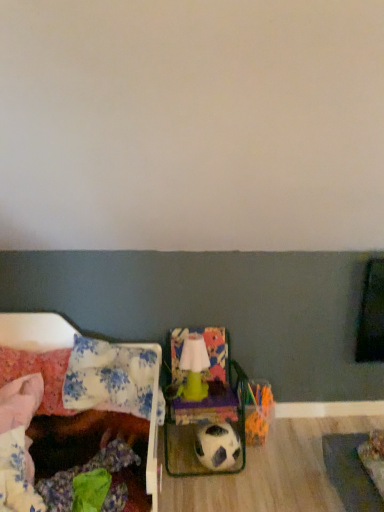
Question: From the image's perspective, is black and white textured football at center positioned above or below matte green armchair at center?

Choices:
 (A) below
 (B) above

Answer: (A)

Question: In terms of width, does black and white textured football at center look wider or thinner when compared to matte green armchair at center?

Choices:
 (A) thin
 (B) wide

Answer: (A)

Question: Which object is positioned closest to the green matte lamp at center?

Choices:
 (A) matte green armchair at center
 (B) black and white textured football at center
 (C) floral fabric bed at left
 (D) floral fabric pillow at left, which is the first pillow in right-to-left order
 (E) fluffy pink pillow at left, the first pillow viewed from the left

Answer: (A)

Question: Which of these objects is positioned closest to the matte green armchair at center?

Choices:
 (A) floral fabric pillow at left, which is the first pillow in right-to-left order
 (B) green matte lamp at center
 (C) floral fabric bed at left
 (D) fluffy pink pillow at left, the first pillow viewed from the left
 (E) black and white textured football at center

Answer: (B)